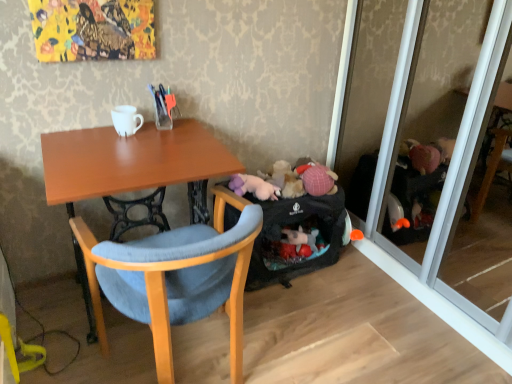
Identify the location of free region on the left part of white glossy coffee cup at upper center. Image resolution: width=512 pixels, height=384 pixels. (85, 135).